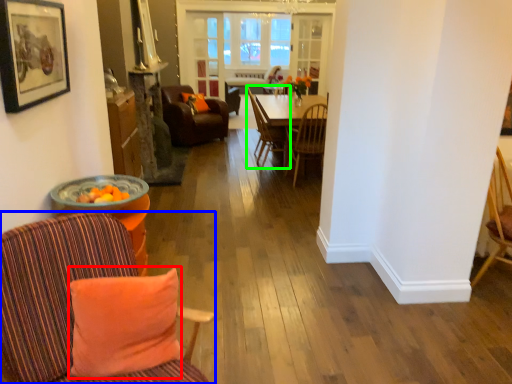
Question: Considering the real-world distances, which object is closest to pillow (highlighted by a red box)? chair (highlighted by a blue box) or chair (highlighted by a green box).

Choices:
 (A) chair
 (B) chair

Answer: (A)